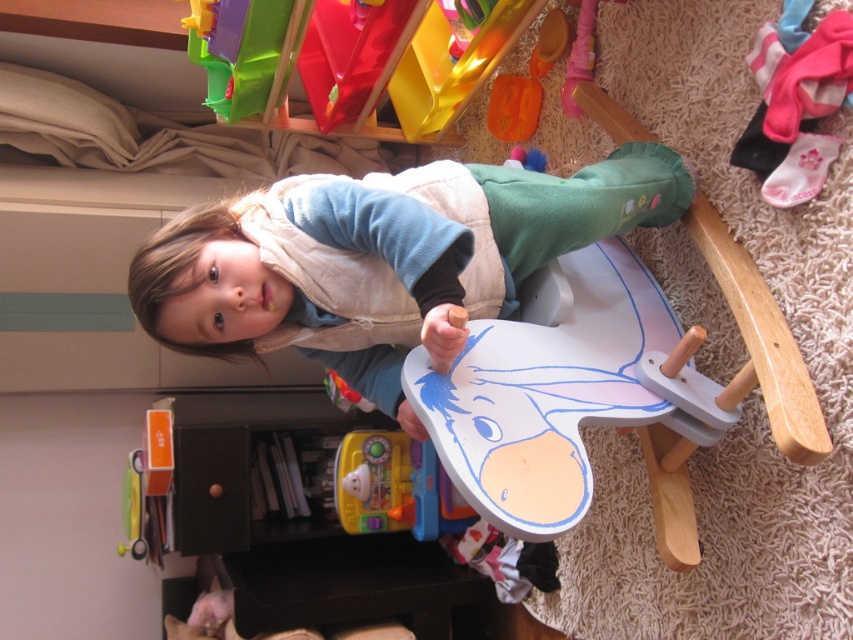
Does wooden rocking horse at lower right appear under brown matte drawer at lower left?

Actually, wooden rocking horse at lower right is above brown matte drawer at lower left.

Who is more distant from viewer, (718, 259) or (233, 484)?

Positioned behind is point (233, 484).

Find the location of a particular element. Image resolution: width=853 pixels, height=640 pixels. wooden rocking horse at lower right is located at coordinates [x=762, y=339].

In order to click on wooden rocking horse at lower right in this screenshot , I will do `click(762, 339)`.

Is yellow plastic toy at lower center taller than brown matte drawer at lower left?

No, yellow plastic toy at lower center is not taller than brown matte drawer at lower left.

Is point (393, 467) positioned behind point (196, 508)?

Yes, point (393, 467) is farther from viewer.

Identify the location of yellow plastic toy at lower center. The width and height of the screenshot is (853, 640). (395, 486).

Does matte white vest at center have a greater height compared to wooden rocking horse at lower right?

No.

This screenshot has width=853, height=640. What do you see at coordinates (383, 257) in the screenshot? I see `matte white vest at center` at bounding box center [383, 257].

Locate an element on the screen. matte white vest at center is located at coordinates (383, 257).

I want to click on matte white vest at center, so click(x=383, y=257).